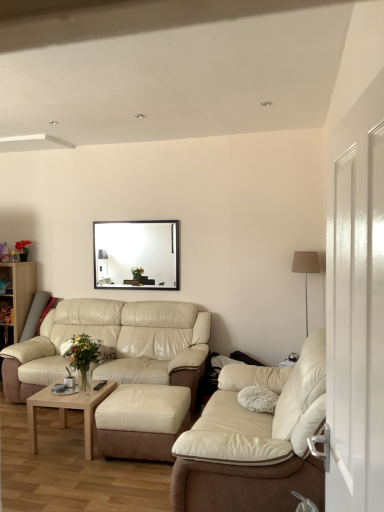
I want to click on free spot in front of light brown wooden coffee table at lower left, so click(77, 467).